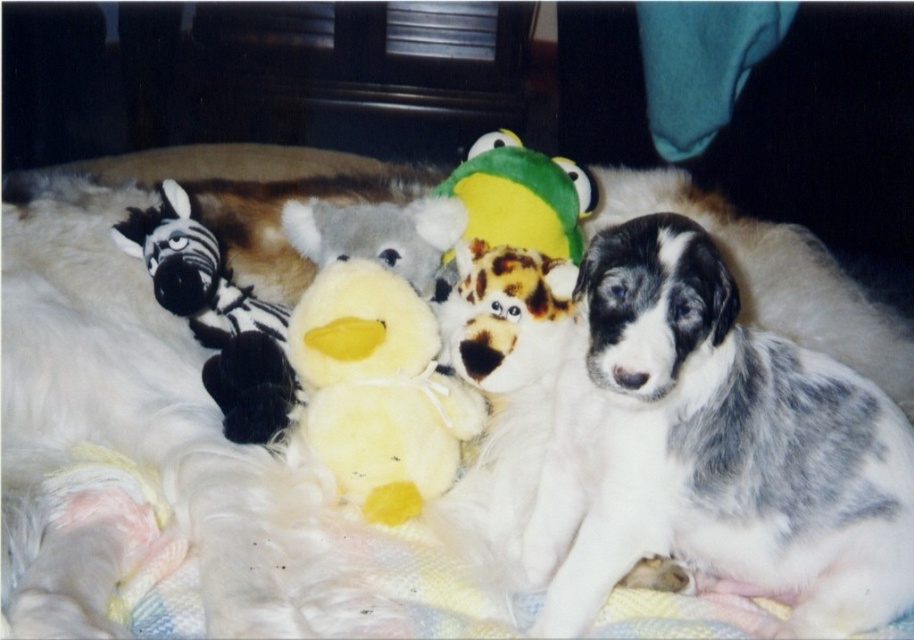
Question: Does fluffy plush dog at center have a larger size compared to green plush frog at center?

Choices:
 (A) no
 (B) yes

Answer: (A)

Question: Estimate the real-world distances between objects in this image. Which object is closer to the fluffy plush dog at center?

Choices:
 (A) fluffy yellow duck at center
 (B) green plush frog at center

Answer: (A)

Question: Which object is positioned closest to the green plush frog at center?

Choices:
 (A) fluffy plush dog at center
 (B) fluffy yellow duck at center

Answer: (A)

Question: Which object appears closest to the camera in this image?

Choices:
 (A) fluffy yellow duck at center
 (B) spotted fur puppy at center
 (C) green plush frog at center

Answer: (B)

Question: Does spotted fur puppy at center have a greater width compared to fluffy plush dog at center?

Choices:
 (A) yes
 (B) no

Answer: (A)

Question: Does spotted fur puppy at center have a larger size compared to fluffy plush dog at center?

Choices:
 (A) yes
 (B) no

Answer: (A)